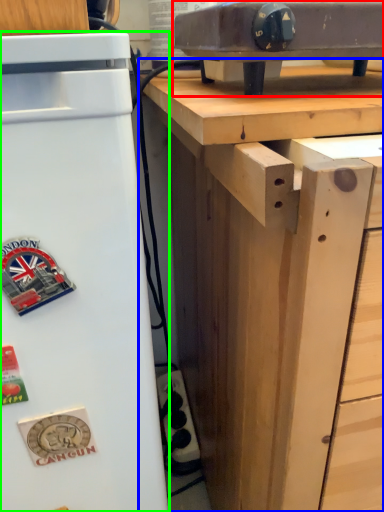
Question: Considering the real-world distances, which object is closest to appliance (highlighted by a red box)? desk (highlighted by a blue box) or refrigerator (highlighted by a green box).

Choices:
 (A) desk
 (B) refrigerator

Answer: (A)